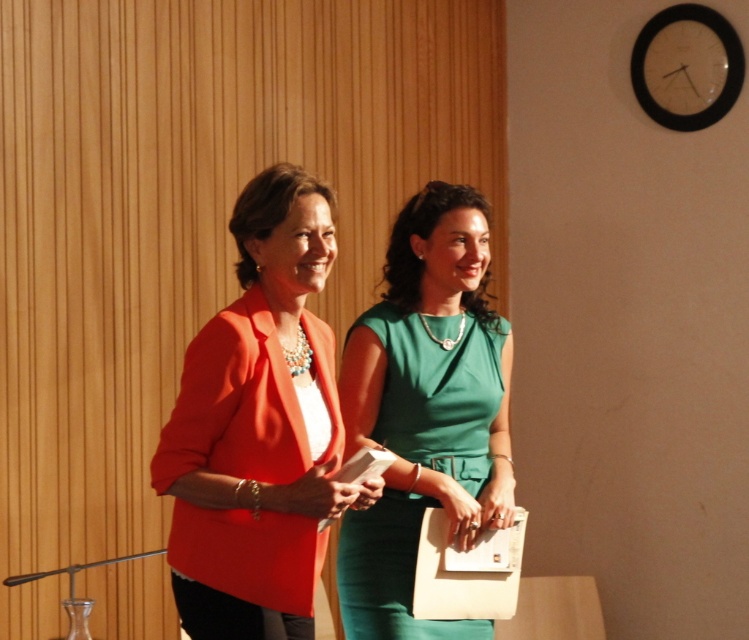
Can you confirm if matte orange blazer at center is positioned to the right of green satin dress at center?

In fact, matte orange blazer at center is to the left of green satin dress at center.

Describe the element at coordinates (258, 428) in the screenshot. I see `matte orange blazer at center` at that location.

Is point (297, 292) closer to camera compared to point (410, 529)?

That is True.

Locate an element on the screen. The height and width of the screenshot is (640, 749). matte orange blazer at center is located at coordinates (258, 428).